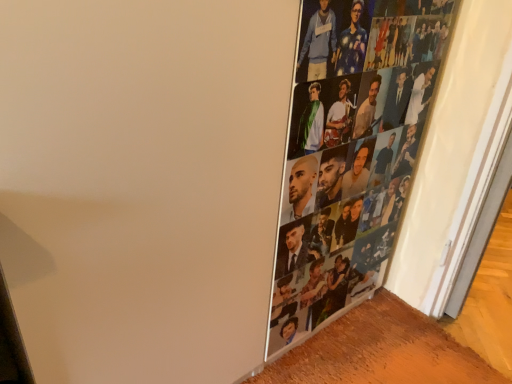
You are a GUI agent. You are given a task and a screenshot of the screen. Output one action in this format:
    pyautogui.click(x=<x>, y=<y>)
    Task: Click on the metallic photo collage at right
    The height and width of the screenshot is (384, 512).
    Given the screenshot: What is the action you would take?
    pyautogui.click(x=351, y=150)

The image size is (512, 384). Describe the element at coordinates (351, 150) in the screenshot. I see `metallic photo collage at right` at that location.

You are a GUI agent. You are given a task and a screenshot of the screen. Output one action in this format:
    pyautogui.click(x=<x>, y=<y>)
    Task: Click on the metallic photo collage at right
    Image resolution: width=512 pixels, height=384 pixels.
    Given the screenshot: What is the action you would take?
    pyautogui.click(x=351, y=150)